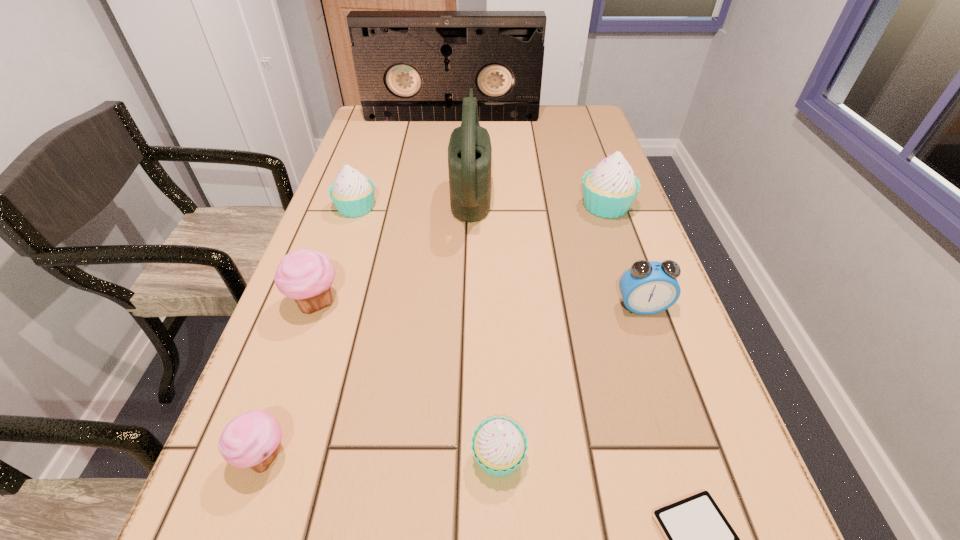
You are a GUI agent. You are given a task and a screenshot of the screen. Output one action in this format:
    pyautogui.click(x=<x>, y=<y>)
    Task: Click on the second white cupcake from left to right
    
    Given the screenshot: What is the action you would take?
    pyautogui.click(x=499, y=445)

You are a GUI agent. You are given a task and a screenshot of the screen. Output one action in this format:
    pyautogui.click(x=<x>, y=<y>)
    Task: Click on the second cupcake from right to left
    This screenshot has height=540, width=960.
    Given the screenshot: What is the action you would take?
    pyautogui.click(x=499, y=445)

Locate an element on the screen. The height and width of the screenshot is (540, 960). the smaller pink cupcake is located at coordinates (251, 440).

Find the location of a particular element. vacant space situated 0.050m on the front side of the farthest object is located at coordinates pos(450,129).

Locate an element on the screen. vacant space located on the spout of the green watering can is located at coordinates (551, 190).

I want to click on vacant space situated on the back of the biggest white cupcake, so click(580, 130).

Where is `vacant space situated 0.320m on the right of the second smallest white cupcake`? vacant space situated 0.320m on the right of the second smallest white cupcake is located at coordinates (506, 207).

You are a GUI agent. You are given a task and a screenshot of the screen. Output one action in this format:
    pyautogui.click(x=<x>, y=<y>)
    Task: Click on the blank area located 0.400m on the back of the bigger pink cupcake
    This screenshot has height=540, width=960.
    Given the screenshot: What is the action you would take?
    pyautogui.click(x=360, y=178)

Locate an element on the screen. This screenshot has width=960, height=540. vacant area located on the face of the alarm clock is located at coordinates (656, 346).

The height and width of the screenshot is (540, 960). Find the location of `vacant space located on the back of the nearest white cupcake`. vacant space located on the back of the nearest white cupcake is located at coordinates (495, 360).